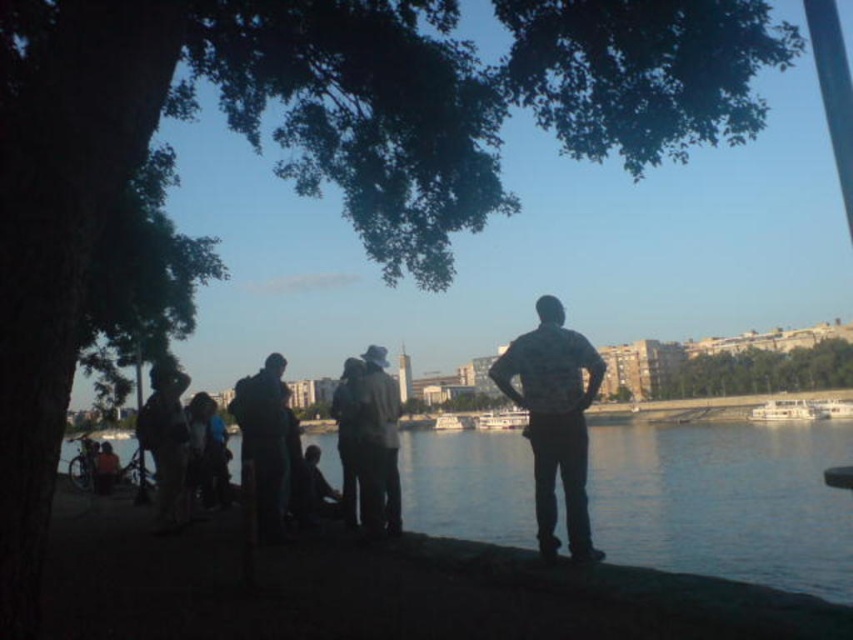
You are a photographer trying to capture a clear shot of the dark gray fabric hat at center and the green leafy tree at center. Since the tree is blocking part of the view, which object should you move closer to in order to get a better unobstructed view of the other?

Since the green leafy tree at center is to the right of the dark gray fabric hat at center, you should move closer to the dark gray fabric hat at center to get a better unobstructed view of the green leafy tree at center.

You are standing at the waterfront and want to place a small flag at the point closer to you between the two points marked as point (537, 310) and point (821, 349). Which point should you choose?

You should choose point (537, 310) because it is closer to the camera than point (821, 349).